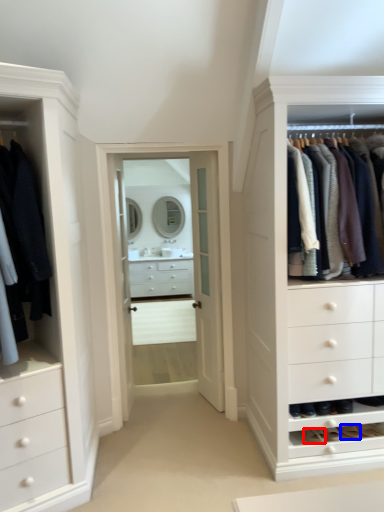
Question: Which of the following is the closest to the observer, shoe (highlighted by a red box) or shoe (highlighted by a blue box)?

Choices:
 (A) shoe
 (B) shoe

Answer: (A)